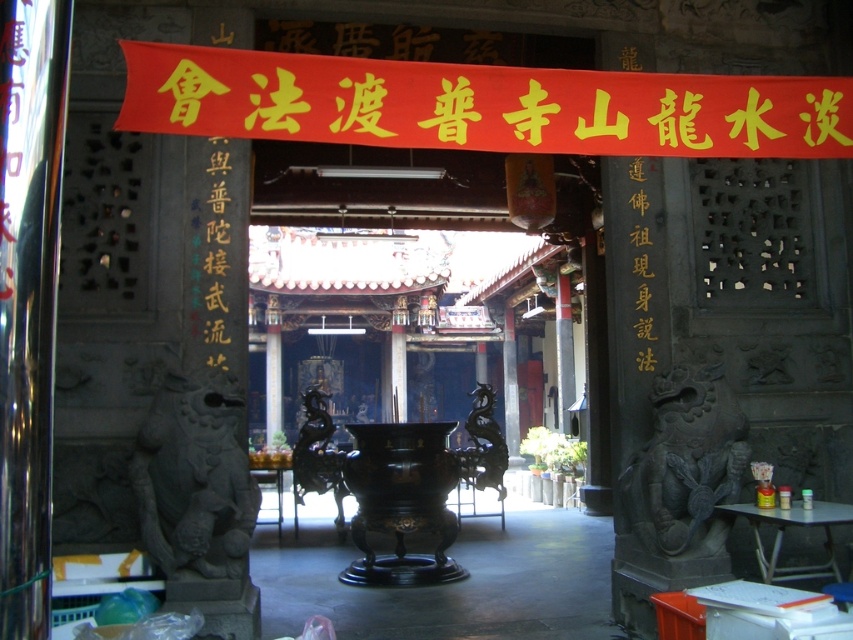
Who is lower down, red paper banner at upper center or black stone lion at left?

black stone lion at left

Where is `red paper banner at upper center`? The width and height of the screenshot is (853, 640). red paper banner at upper center is located at coordinates (480, 106).

This screenshot has width=853, height=640. In order to click on red paper banner at upper center in this screenshot , I will do `click(480, 106)`.

Does black stone lion at left have a smaller size compared to black stone lion at right?

Yes.

Can you confirm if black stone lion at left is positioned above black stone lion at right?

Yes, black stone lion at left is above black stone lion at right.

The image size is (853, 640). What do you see at coordinates (194, 481) in the screenshot?
I see `black stone lion at left` at bounding box center [194, 481].

I want to click on black stone lion at left, so click(194, 481).

Between red paper banner at upper center and black stone lion at right, which one is positioned higher?

red paper banner at upper center is above.

Identify the location of red paper banner at upper center. This screenshot has height=640, width=853. (480, 106).